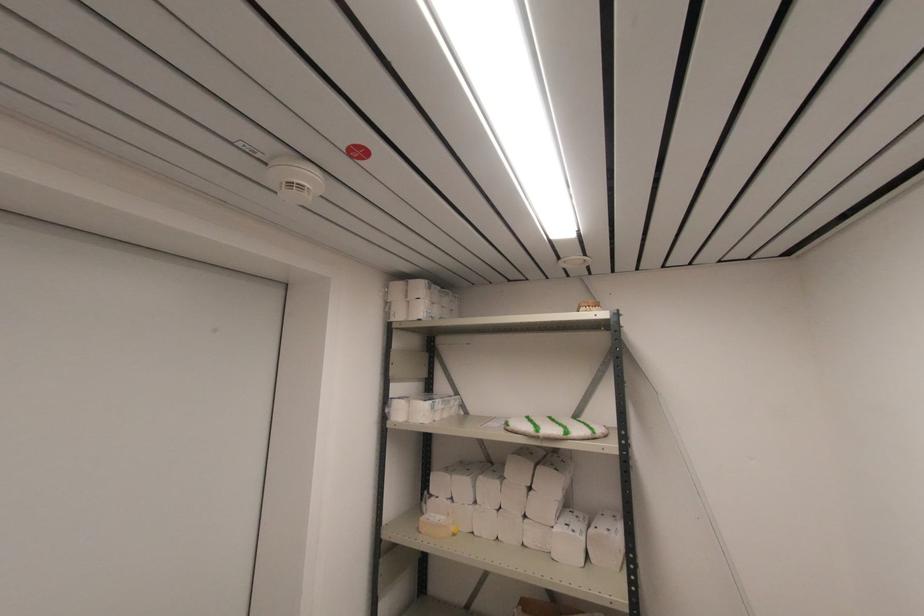
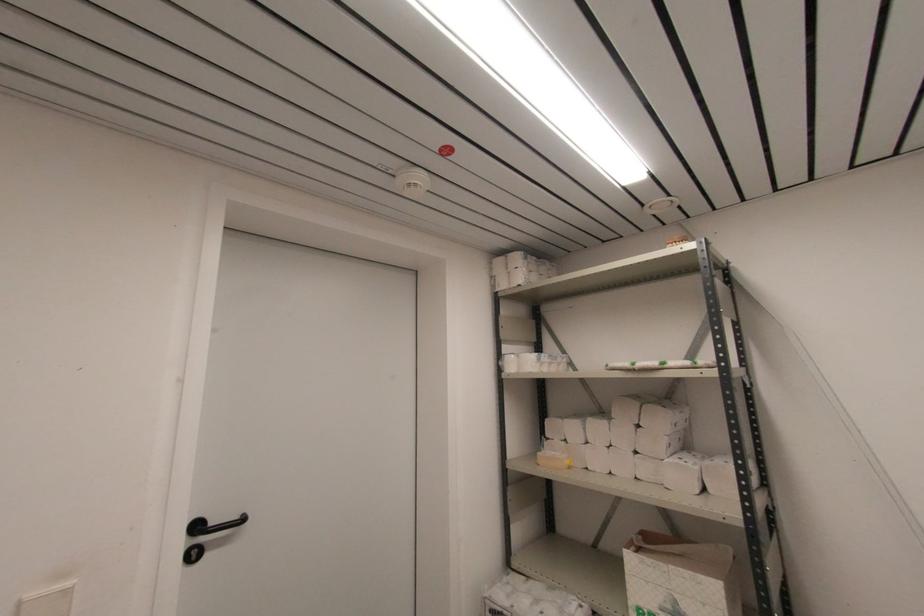
Question: Based on the continuous images, in which direction is the camera rotating? Reply with the corresponding letter.

Choices:
 (A) Left
 (B) Right
 (C) Up
 (D) Down

Answer: (A)